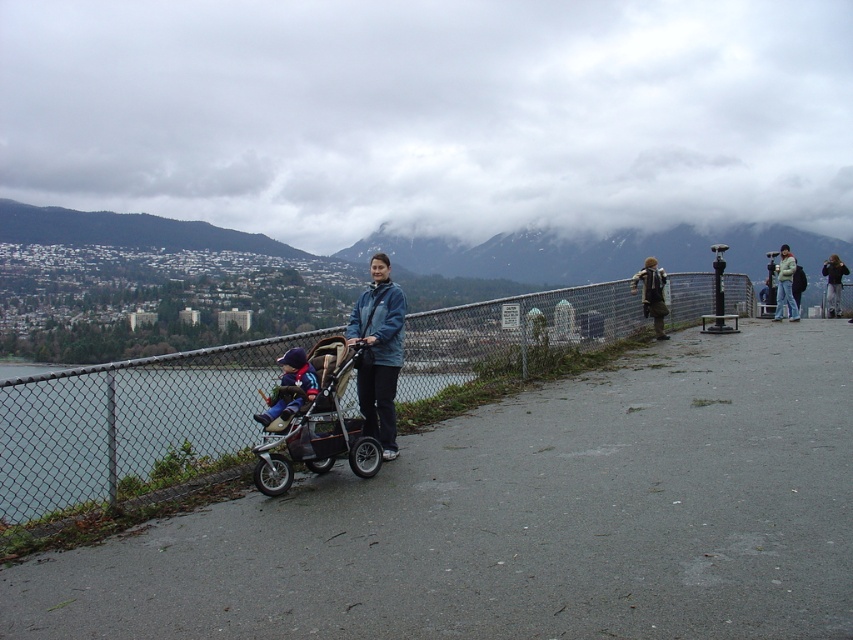
Question: Can you confirm if cloudy sky at upper center is positioned below silver metallic stroller at center?

Choices:
 (A) no
 (B) yes

Answer: (A)

Question: Which point is closer to the camera?

Choices:
 (A) (386, 74)
 (B) (376, 438)
 (C) (657, 284)
 (D) (79, 442)

Answer: (D)

Question: Which point is farther to the camera?

Choices:
 (A) silver metallic stroller at center
 (B) clear water at stroller left
 (C) matte blue jacket at center
 (D) dark brown backpack at center-right

Answer: (D)

Question: Does matte blue jacket at center have a lesser width compared to light gray jacket at upper right?

Choices:
 (A) no
 (B) yes

Answer: (B)

Question: Observing the image, what is the correct spatial positioning of silver metallic stroller at center in reference to dark brown backpack at center-right?

Choices:
 (A) below
 (B) above

Answer: (A)

Question: Among these objects, which one is farthest from the camera?

Choices:
 (A) light gray jacket at upper right
 (B) smooth asphalt path at center
 (C) matte blue jacket at center
 (D) silver metallic stroller at center

Answer: (A)